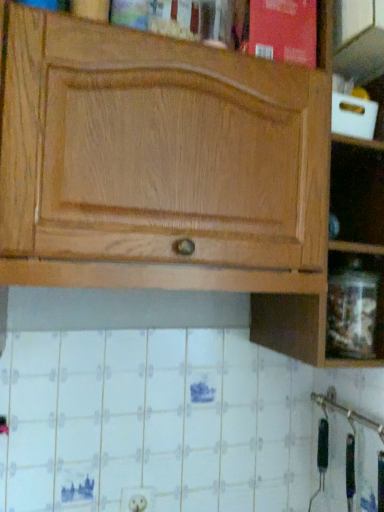
Measure the distance between point (372, 345) and camera.

Point (372, 345) and camera are 36.46 inches apart.

The height and width of the screenshot is (512, 384). What do you see at coordinates (137, 499) in the screenshot?
I see `white plastic electric outlet at lower center` at bounding box center [137, 499].

Find the location of a particular element. transparent glass jar at lower right is located at coordinates (355, 307).

From a real-world perspective, which is physically below, white plastic electric outlet at lower center or natural wood cabinet at upper center?

In real-world perspective, white plastic electric outlet at lower center is lower.

What's the angular difference between white plastic electric outlet at lower center and natural wood cabinet at upper center's facing directions?

The facing directions of white plastic electric outlet at lower center and natural wood cabinet at upper center are 0.0016 degrees apart.

Could you tell me if white plastic electric outlet at lower center is turned towards natural wood cabinet at upper center?

No, white plastic electric outlet at lower center is not aimed at natural wood cabinet at upper center.

Is white plastic electric outlet at lower center next to natural wood cabinet at upper center?

No.

Does transparent glass jar at lower right turn towards white plastic electric outlet at lower center?

No, transparent glass jar at lower right is not oriented towards white plastic electric outlet at lower center.

From the image's perspective, which is below, transparent glass jar at lower right or white plastic electric outlet at lower center?

white plastic electric outlet at lower center.

Which object is positioned more to the left, transparent glass jar at lower right or white plastic electric outlet at lower center?

Positioned to the left is white plastic electric outlet at lower center.

Locate an element on the screen. This screenshot has height=512, width=384. glass jar on the right of natural wood cabinet at upper center is located at coordinates (355, 307).

Which object is positioned more to the left, natural wood cabinet at upper center or transparent glass jar at lower right?

natural wood cabinet at upper center is more to the left.

Looking at their sizes, would you say natural wood cabinet at upper center is wider or thinner than transparent glass jar at lower right?

In the image, natural wood cabinet at upper center appears to be wider than transparent glass jar at lower right.

From the image's perspective, is natural wood cabinet at upper center below transparent glass jar at lower right?

Actually, natural wood cabinet at upper center appears above transparent glass jar at lower right in the image.

Between white plastic electric outlet at lower center and transparent glass jar at lower right, which one has less height?

With less height is white plastic electric outlet at lower center.

Is white plastic electric outlet at lower center smaller than transparent glass jar at lower right?

Yes, white plastic electric outlet at lower center is smaller than transparent glass jar at lower right.

Consider the image. Considering the sizes of objects white plastic electric outlet at lower center and transparent glass jar at lower right in the image provided, who is wider, white plastic electric outlet at lower center or transparent glass jar at lower right?

With larger width is transparent glass jar at lower right.

Can you tell me how much white plastic electric outlet at lower center and transparent glass jar at lower right differ in facing direction?

4.46 degrees separate the facing orientations of white plastic electric outlet at lower center and transparent glass jar at lower right.

Based on the photo, from a real-world perspective, is transparent glass jar at lower right under natural wood cabinet at upper center?

Yes, from a real-world perspective, transparent glass jar at lower right is beneath natural wood cabinet at upper center.

Is transparent glass jar at lower right oriented towards natural wood cabinet at upper center?

Yes, transparent glass jar at lower right is oriented towards natural wood cabinet at upper center.

Which object is closer to the camera, transparent glass jar at lower right or natural wood cabinet at upper center?

natural wood cabinet at upper center is more forward.

Considering the relative positions of natural wood cabinet at upper center and white plastic electric outlet at lower center in the image provided, is natural wood cabinet at upper center to the right of white plastic electric outlet at lower center from the viewer's perspective?

Correct, you'll find natural wood cabinet at upper center to the right of white plastic electric outlet at lower center.

Considering the relative sizes of natural wood cabinet at upper center and white plastic electric outlet at lower center in the image provided, is natural wood cabinet at upper center wider than white plastic electric outlet at lower center?

Correct, the width of natural wood cabinet at upper center exceeds that of white plastic electric outlet at lower center.

How many degrees apart are the facing directions of natural wood cabinet at upper center and white plastic electric outlet at lower center?

natural wood cabinet at upper center and white plastic electric outlet at lower center are facing 0.0016 degrees away from each other.

Which is behind, point (109, 284) or point (149, 488)?

The point (149, 488) is farther from the camera.

The width and height of the screenshot is (384, 512). I want to click on cabinetry positioned vertically above the white plastic electric outlet at lower center (from a real-world perspective), so click(x=168, y=170).

Locate an element on the screen. The image size is (384, 512). glass jar above the white plastic electric outlet at lower center (from the image's perspective) is located at coordinates (355, 307).

Looking at the image, which one is located further to natural wood cabinet at upper center, transparent glass jar at lower right or white plastic electric outlet at lower center?

white plastic electric outlet at lower center lies further to natural wood cabinet at upper center than the other object.

From the picture: Which object lies nearer to the anchor point transparent glass jar at lower right, white plastic electric outlet at lower center or natural wood cabinet at upper center?

Among the two, natural wood cabinet at upper center is located nearer to transparent glass jar at lower right.

When comparing their distances from natural wood cabinet at upper center, does white plastic electric outlet at lower center or transparent glass jar at lower right seem further?

white plastic electric outlet at lower center is further to natural wood cabinet at upper center.

Estimate the real-world distances between objects in this image. Which object is closer to white plastic electric outlet at lower center, natural wood cabinet at upper center or transparent glass jar at lower right?

Among the two, transparent glass jar at lower right is located nearer to white plastic electric outlet at lower center.

Which object lies nearer to the anchor point transparent glass jar at lower right, natural wood cabinet at upper center or white plastic electric outlet at lower center?

natural wood cabinet at upper center is closer to transparent glass jar at lower right.

Estimate the real-world distances between objects in this image. Which object is further from white plastic electric outlet at lower center, transparent glass jar at lower right or natural wood cabinet at upper center?

Among the two, natural wood cabinet at upper center is located further to white plastic electric outlet at lower center.

Identify the location of glass jar between natural wood cabinet at upper center and white plastic electric outlet at lower center from top to bottom. (355, 307).